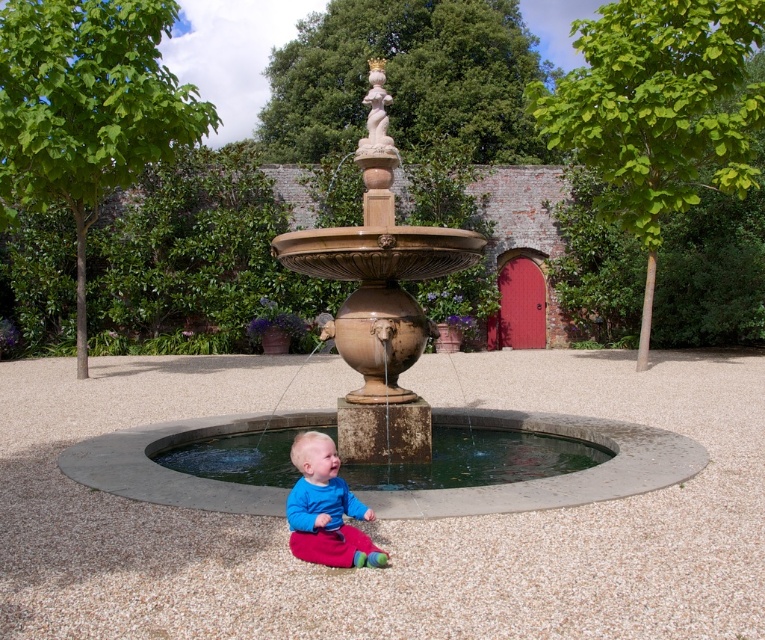
You are a gardener who needs to place a small potted plant between the smooth gravel at center and the white stone statue at upper center. According to the scene description, which object should the plant be closer to?

The smooth gravel at center is positioned on the left side of white stone statue at upper center, so the plant should be placed closer to the white stone statue at upper center to be between them.